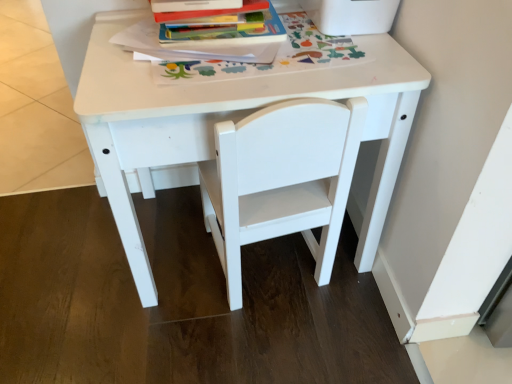
At what (x,y) coordinates should I click in order to perform the action: click on white matte table at center. Please return your answer as a coordinate pair (x, y). This screenshot has height=384, width=512. Looking at the image, I should click on (225, 119).

Describe the element at coordinates (225, 119) in the screenshot. I see `white matte table at center` at that location.

What do you see at coordinates (281, 180) in the screenshot?
I see `white matte chair at center` at bounding box center [281, 180].

Locate an element on the screen. This screenshot has height=384, width=512. white matte table at center is located at coordinates (225, 119).

Is the depth of white matte chair at center less than that of white matte table at center?

Yes, it is.

Considering the relative sizes of white matte chair at center and white matte table at center in the image provided, is white matte chair at center thinner than white matte table at center?

Correct, the width of white matte chair at center is less than that of white matte table at center.

Is white matte chair at center smaller than white matte table at center?

Yes, white matte chair at center is smaller than white matte table at center.

Based on the photo, can you tell me how much white matte chair at center and white matte table at center differ in facing direction?

The facing directions of white matte chair at center and white matte table at center are 173 degrees apart.

From the image's perspective, who appears lower, hardcover book at upper center or white matte table at center?

white matte table at center, from the image's perspective.

Who is shorter, hardcover book at upper center or white matte table at center?

With less height is hardcover book at upper center.

In terms of width, does hardcover book at upper center look wider or thinner when compared to white matte table at center?

Considering their sizes, hardcover book at upper center looks slimmer than white matte table at center.

From a real-world perspective, which is physically above, hardcover book at upper center or white matte table at center?

hardcover book at upper center.

From the picture: Between hardcover book at upper center and white matte chair at center, which one has more height?

white matte chair at center.

From a real-world perspective, is hardcover book at upper center physically below white matte chair at center?

No, from a real-world perspective, hardcover book at upper center is not below white matte chair at center.

How many degrees apart are the facing directions of hardcover book at upper center and white matte chair at center?

They differ by 170 degrees in their facing directions.

Is white matte table at center wider or thinner than white matte chair at center?

white matte table at center is wider than white matte chair at center.

Between point (161, 136) and point (307, 182), which one is positioned in front?

The point (161, 136) is in front.

Consider the image. Is white matte table at center located outside white matte chair at center?

No, white matte table at center is inside or overlapping with white matte chair at center.

Does white matte table at center come behind white matte chair at center?

Yes, white matte table at center is behind white matte chair at center.

Are white matte table at center and hardcover book at upper center far apart?

No, white matte table at center is not far from hardcover book at upper center.

Choose the correct answer: Is white matte table at center inside hardcover book at upper center or outside it?

white matte table at center is not inside hardcover book at upper center, it's outside.

Between white matte table at center and hardcover book at upper center, which one has smaller size?

hardcover book at upper center is smaller.

Can you confirm if white matte chair at center is shorter than hardcover book at upper center?

No.

This screenshot has width=512, height=384. Identify the location of paperback book on the left of white matte chair at center. (209, 39).

Consider the image. Is white matte chair at center not near hardcover book at upper center?

No, white matte chair at center is not far away from hardcover book at upper center.

Locate an element on the screen. This screenshot has height=384, width=512. table above the white matte chair at center (from the image's perspective) is located at coordinates (225, 119).

Identify the location of table located on the right of hardcover book at upper center. (225, 119).

Estimate the real-world distances between objects in this image. Which object is further from white matte table at center, hardcover book at upper center or white matte chair at center?

hardcover book at upper center is further to white matte table at center.

From the image, which object appears to be farther from hardcover book at upper center, white matte chair at center or white matte table at center?

Based on the image, white matte chair at center appears to be further to hardcover book at upper center.

Which object lies nearer to the anchor point hardcover book at upper center, white matte table at center or white matte chair at center?

The object closer to hardcover book at upper center is white matte table at center.

From the image, which object appears to be farther from white matte table at center, white matte chair at center or hardcover book at upper center?

hardcover book at upper center is further to white matte table at center.

Which object lies nearer to the anchor point white matte chair at center, hardcover book at upper center or white matte table at center?

white matte table at center.

Looking at the image, which one is located closer to white matte chair at center, white matte table at center or hardcover book at upper center?

white matte table at center is positioned closer to the anchor white matte chair at center.

Find the location of a particular element. The width and height of the screenshot is (512, 384). table between hardcover book at upper center and white matte chair at center vertically is located at coordinates (225, 119).